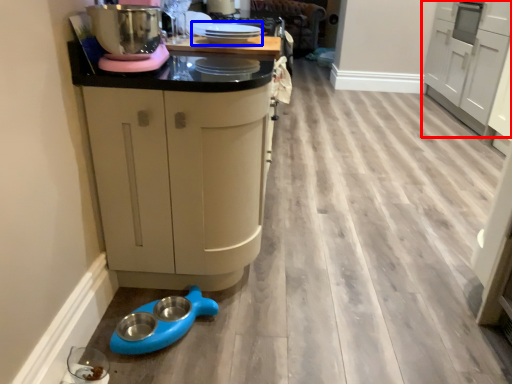
Question: Which object is closer to the camera taking this photo, cabinetry (highlighted by a red box) or appliance (highlighted by a blue box)?

Choices:
 (A) cabinetry
 (B) appliance

Answer: (B)